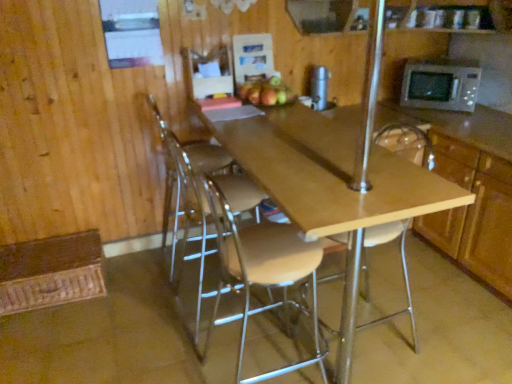
You are a GUI agent. You are given a task and a screenshot of the screen. Output one action in this format:
    pyautogui.click(x=<x>, y=<y>)
    Task: Click on the free space to the left of clear plastic chair at center, which is counted as the first chair, starting from the left
    The height and width of the screenshot is (384, 512).
    Given the screenshot: What is the action you would take?
    pyautogui.click(x=140, y=270)